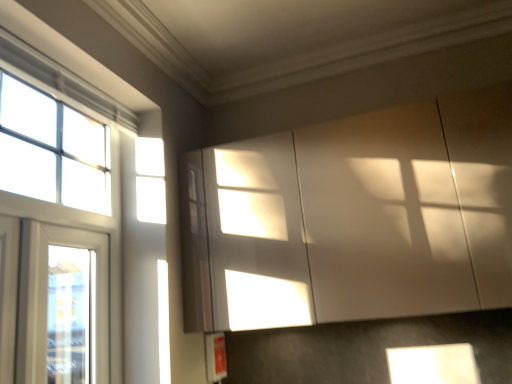
Question: From the image's perspective, is clear glass window at upper left, which appears as the 1th window when viewed from the top, located above or below white glass window at left, acting as the first window starting from the bottom?

Choices:
 (A) below
 (B) above

Answer: (B)

Question: Which is correct: clear glass window at upper left, which appears as the 1th window when viewed from the top, is inside white glass window at left, the 3th window when ordered from top to bottom, or outside of it?

Choices:
 (A) inside
 (B) outside

Answer: (B)

Question: Which object is positioned farthest from the white glass window at left, which ranks as the 2th window in bottom-to-top order?

Choices:
 (A) clear glass window at upper left, which appears as the 1th window when viewed from the top
 (B) white glass window at left, acting as the first window starting from the bottom
 (C) white glossy cabinet at upper right

Answer: (C)

Question: Which is farther from the white glass window at left, placed as the 2th window when sorted from top to bottom?

Choices:
 (A) clear glass window at upper left, which appears as the 1th window when viewed from the top
 (B) white glossy cabinet at upper right
 (C) white glass window at left, the 3th window when ordered from top to bottom

Answer: (B)